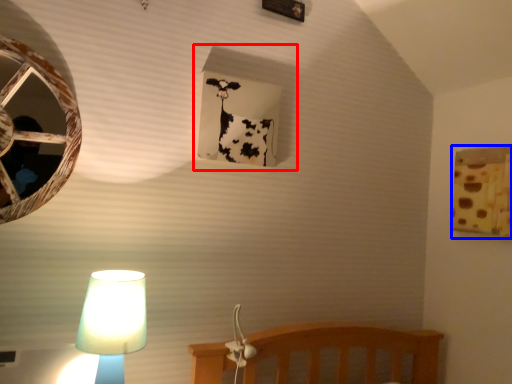
Question: Which object is closer to the camera taking this photo, window frame (highlighted by a red box) or window frame (highlighted by a blue box)?

Choices:
 (A) window frame
 (B) window frame

Answer: (A)